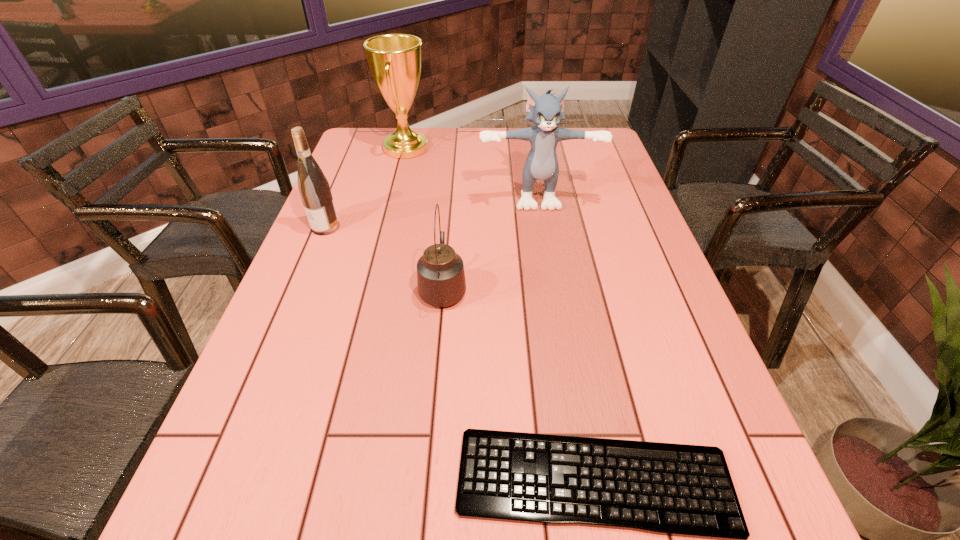
This screenshot has height=540, width=960. What are the coordinates of `the fourth object from right to left` in the screenshot? It's located at (394, 60).

At what (x,y) coordinates should I click in order to perform the action: click on the farthest object. Please return your answer as a coordinate pair (x, y). This screenshot has height=540, width=960. Looking at the image, I should click on (394, 60).

Locate an element on the screen. The height and width of the screenshot is (540, 960). the fourth nearest object is located at coordinates (545, 111).

Image resolution: width=960 pixels, height=540 pixels. What are the coordinates of `the leftmost object` in the screenshot? It's located at (313, 186).

Where is `wine bottle`? The image size is (960, 540). wine bottle is located at coordinates (313, 186).

Where is `the second shortest object`? The height and width of the screenshot is (540, 960). the second shortest object is located at coordinates (441, 282).

This screenshot has width=960, height=540. In order to click on the second nearest object in this screenshot , I will do `click(441, 282)`.

At what (x,y) coordinates should I click in order to perform the action: click on free space located by the handles of the award. Please return your answer as a coordinate pair (x, y). This screenshot has height=540, width=960. Looking at the image, I should click on (540, 148).

Find the location of a particular element. This screenshot has width=960, height=540. vacant region located on the front-facing side of the cat is located at coordinates (543, 236).

The width and height of the screenshot is (960, 540). In order to click on free space located 0.240m on the front of the leftmost object in this screenshot , I will do `click(296, 300)`.